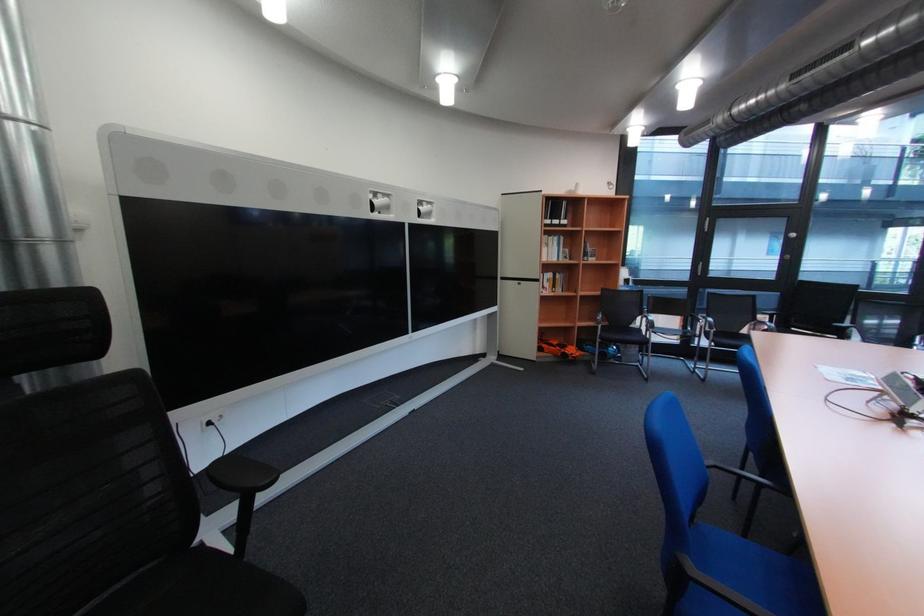
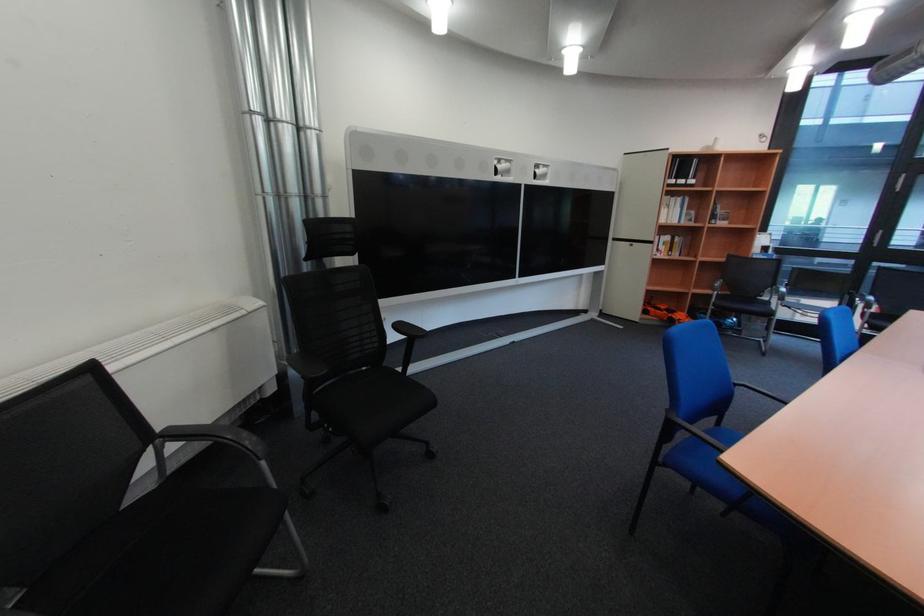
Question: The camera is either moving clockwise (left) or counter-clockwise (right) around the object. The first image is from the beginning of the video and the second image is from the end. Is the camera moving left or right when shooting the video?

Choices:
 (A) Left
 (B) Right

Answer: (B)